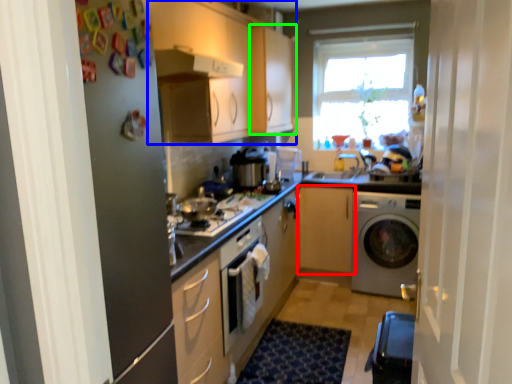
Question: Which is farther away from cabinetry (highlighted by a red box)? cabinetry (highlighted by a blue box) or cabinetry (highlighted by a green box)?

Choices:
 (A) cabinetry
 (B) cabinetry

Answer: (A)